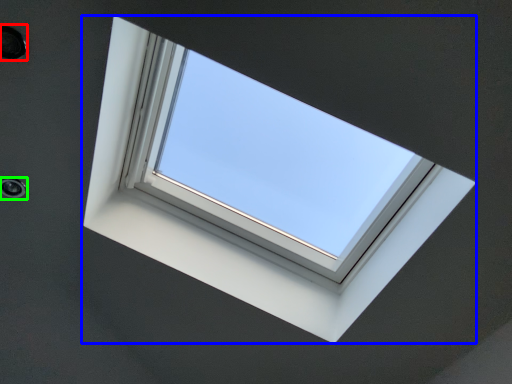
Question: Based on their relative distances, which object is nearer to hole (highlighted by a red box)? Choose from window (highlighted by a blue box) and hole (highlighted by a green box).

Choices:
 (A) window
 (B) hole

Answer: (B)